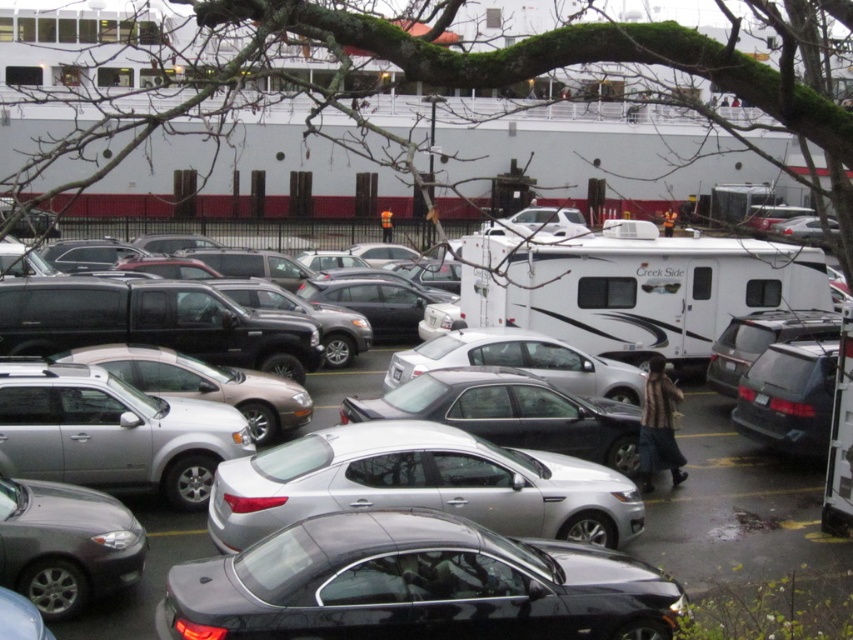
Question: Which of the following is the farthest from the observer?

Choices:
 (A) silver metallic car at center
 (B) satin silver sedan at center
 (C) satin silver sedan at lower left

Answer: (B)

Question: Observing the image, what is the correct spatial positioning of glossy black sedan at center in reference to satin silver sedan at lower left?

Choices:
 (A) below
 (B) above

Answer: (B)

Question: Does glossy black sedan at center appear on the right side of satin black suv at right?

Choices:
 (A) yes
 (B) no

Answer: (B)

Question: Estimate the real-world distances between objects in this image. Which object is farther from the silver metallic car at center?

Choices:
 (A) satin silver sedan at lower left
 (B) satin silver sedan at center
 (C) glossy black sedan at center
 (D) satin black suv at right

Answer: (C)

Question: Is satin silver sedan at center above satin silver sedan at lower left?

Choices:
 (A) yes
 (B) no

Answer: (A)

Question: Among these points, which one is farthest from the camera?

Choices:
 (A) (213, 596)
 (B) (697, 474)
 (C) (747, 401)

Answer: (C)